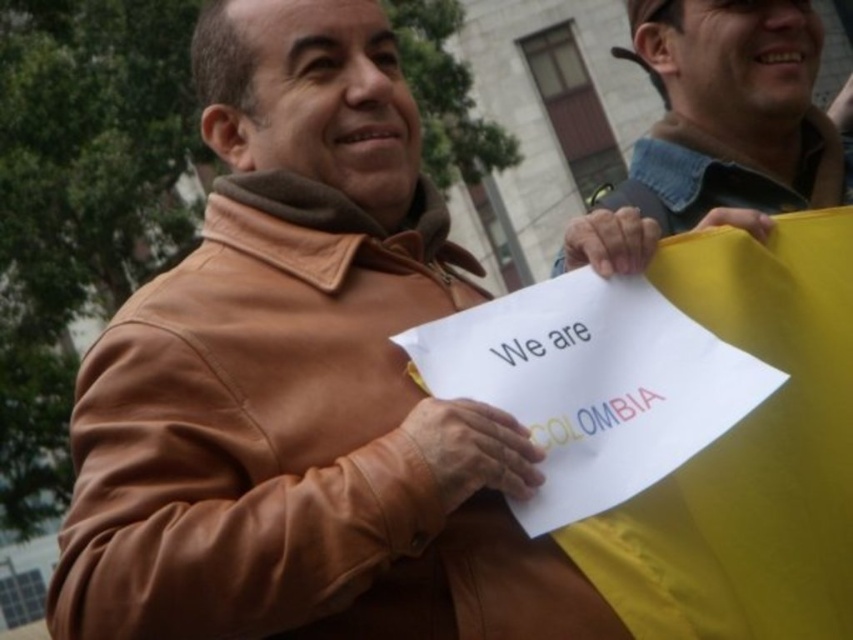
You are a photographer standing at the center of the scene. You want to take a photo that includes both the brown leather jacket at center and the yellow flag or cloth that the second person is holding. Considering their distance, will you be able to capture both in a single frame?

The two objects are 28.21 meters apart. Since the photographer is at the center, the distance from the photographer to each object would be about 14.105 meters. Depending on the camera lens, if it has a wide enough angle or zoom capability, it might be possible. However, standard lenses typically have a limited field of view at such distances, so it may require a wide angle lens or moving closer.

You are a photographer trying to capture both the brown leather jacket at center and the denim jacket at upper right in a single frame. Based on their sizes, which jacket would you need to position closer to the camera to ensure both fit within the shot?

The brown leather jacket at center is wider than the denim jacket at upper right. To fit both in the frame, position the brown leather jacket at center closer to the camera since its larger size requires more space, while the denim jacket at upper right can be placed slightly farther back to balance the composition.